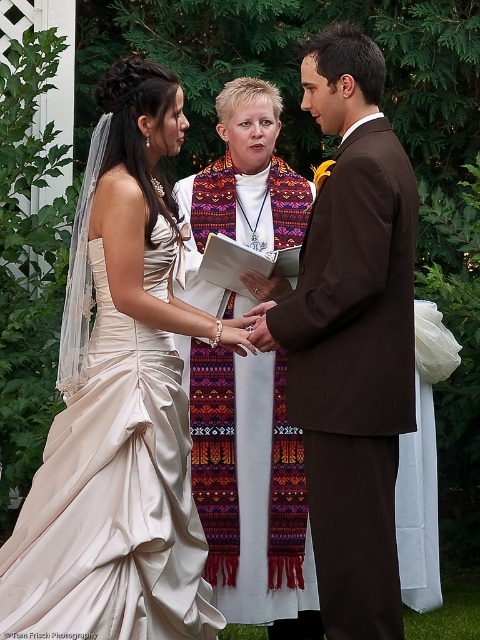
Does ivory satin dress at center come behind brown suit at center?

No, ivory satin dress at center is in front of brown suit at center.

Does point (131, 138) lie behind point (354, 406)?

Yes, point (131, 138) is behind point (354, 406).

What are the coordinates of `ivory satin dress at center` in the screenshot? It's located at (119, 404).

Is ivory satin dress at center to the left of white silk veil at upper left from the viewer's perspective?

Correct, you'll find ivory satin dress at center to the left of white silk veil at upper left.

Can you confirm if ivory satin dress at center is positioned above white silk veil at upper left?

Indeed, ivory satin dress at center is positioned over white silk veil at upper left.

Image resolution: width=480 pixels, height=640 pixels. What are the coordinates of `ivory satin dress at center` in the screenshot? It's located at (119, 404).

Does brown suit at center appear on the left side of white silk veil at upper left?

In fact, brown suit at center is to the right of white silk veil at upper left.

Describe the element at coordinates (351, 337) in the screenshot. This screenshot has height=640, width=480. I see `brown suit at center` at that location.

This screenshot has width=480, height=640. In order to click on brown suit at center in this screenshot , I will do `click(351, 337)`.